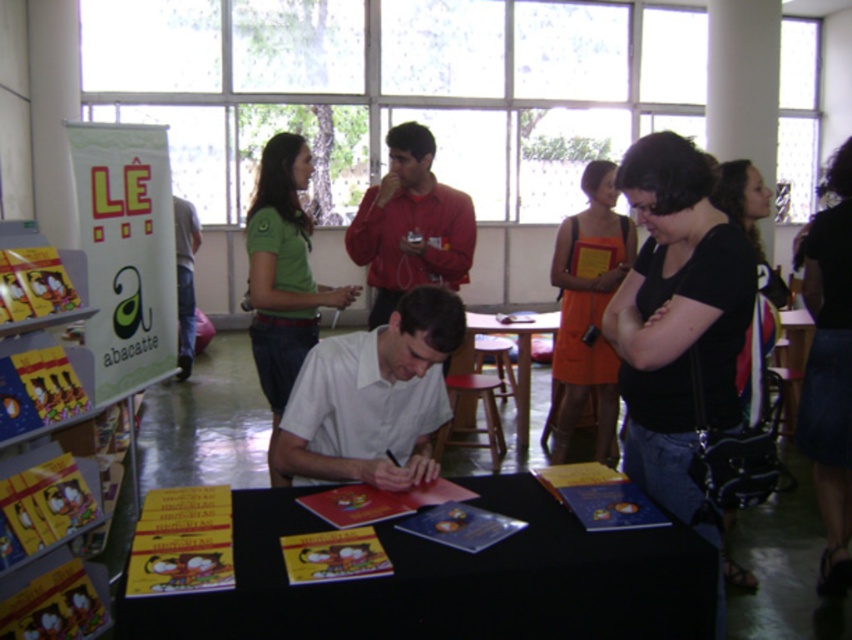
Does green matte shirt at upper left appear over orange fabric dress at center?

Correct, green matte shirt at upper left is located above orange fabric dress at center.

Can you confirm if green matte shirt at upper left is shorter than orange fabric dress at center?

Yes.

Looking at this image, who is more forward, (286, 387) or (568, 353)?

Point (286, 387) is in front.

Where is `green matte shirt at upper left`? Image resolution: width=852 pixels, height=640 pixels. green matte shirt at upper left is located at coordinates (283, 275).

This screenshot has width=852, height=640. Find the location of `white matte shirt at center`. white matte shirt at center is located at coordinates (373, 397).

The width and height of the screenshot is (852, 640). What are the coordinates of `white matte shirt at center` in the screenshot? It's located at (373, 397).

Which is more to the left, green matte shirt at upper left or jeans at left?

jeans at left is more to the left.

Does green matte shirt at upper left come behind jeans at left?

That is False.

At what (x,y) coordinates should I click in order to perform the action: click on green matte shirt at upper left. Please return your answer as a coordinate pair (x, y). The width and height of the screenshot is (852, 640). Looking at the image, I should click on [283, 275].